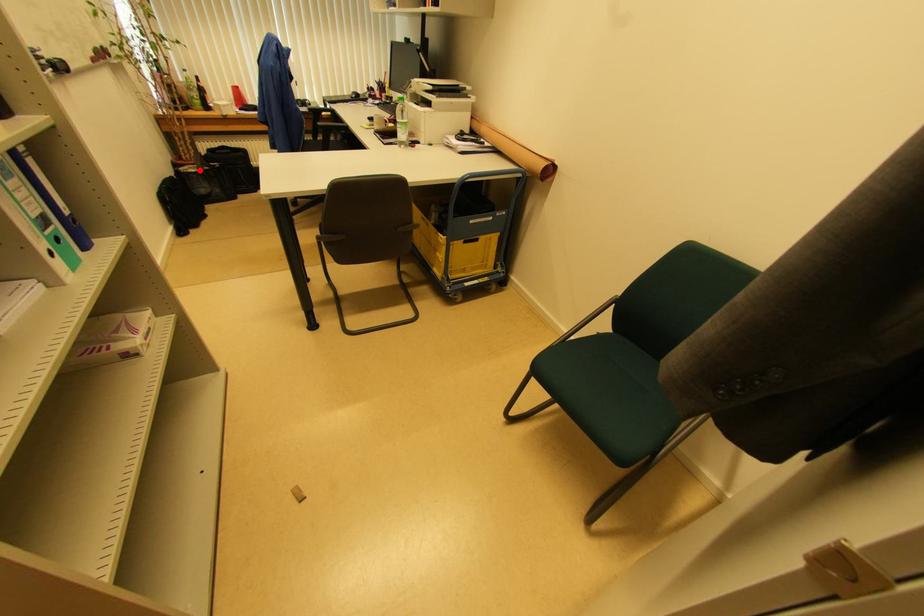
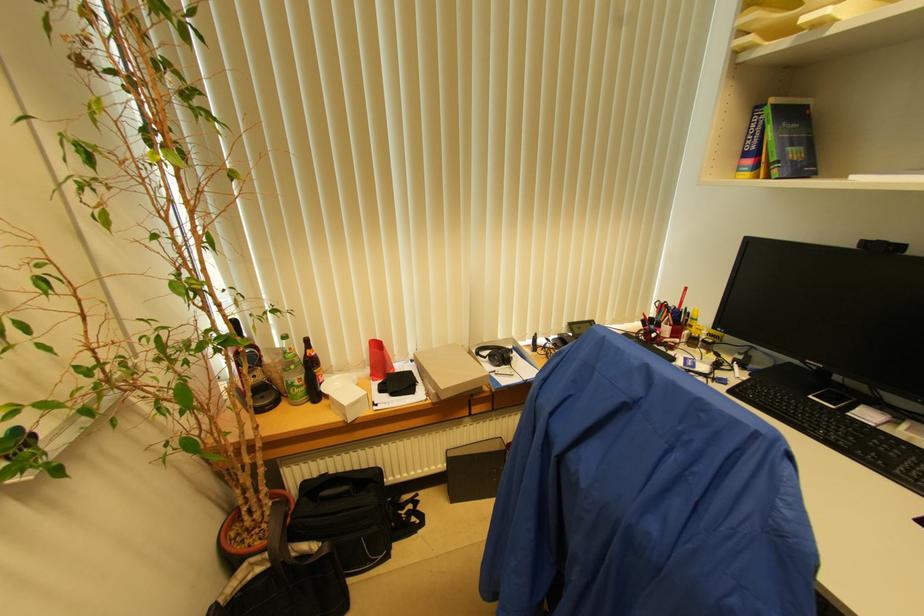
Locate, in the second image, the point that corresponds to the highlighted location in the first image.

(273, 561)